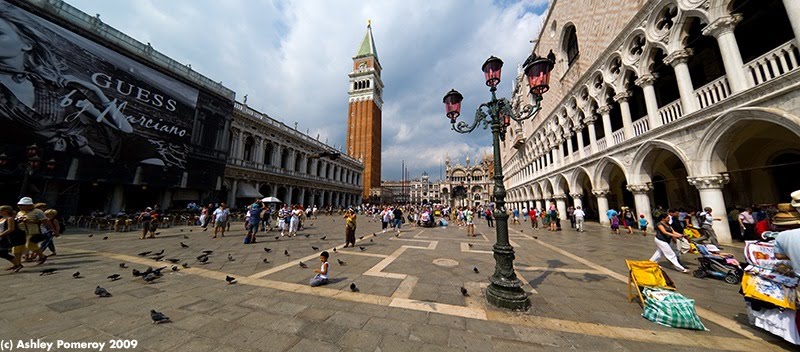
Where is `light`? The width and height of the screenshot is (800, 352). light is located at coordinates (450, 106).